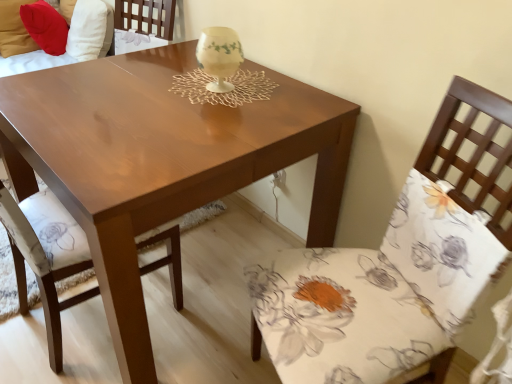
Question: Is velvet red pillow at upper left, marked as the second couch in a left-to-right arrangement, far away from ivory porcelain candle holder at center?

Choices:
 (A) yes
 (B) no

Answer: (A)

Question: Is the depth of velvet red pillow at upper left, marked as the second couch in a left-to-right arrangement, less than that of ivory porcelain candle holder at center?

Choices:
 (A) no
 (B) yes

Answer: (A)

Question: From a real-world perspective, is velvet red pillow at upper left, positioned as the 1th couch in right-to-left order, positioned over ivory porcelain candle holder at center based on gravity?

Choices:
 (A) no
 (B) yes

Answer: (A)

Question: From the image's perspective, is velvet red pillow at upper left, marked as the second couch in a left-to-right arrangement, below ivory porcelain candle holder at center?

Choices:
 (A) no
 (B) yes

Answer: (A)

Question: Would you say velvet red pillow at upper left, positioned as the 1th couch in right-to-left order, is outside ivory porcelain candle holder at center?

Choices:
 (A) yes
 (B) no

Answer: (A)

Question: Is velvet red pillow at upper left, positioned as the 1th couch in right-to-left order, wider than ivory porcelain candle holder at center?

Choices:
 (A) no
 (B) yes

Answer: (B)

Question: Does floral fabric chair at right, the 1th chair from the right, appear on the right side of ivory porcelain candle holder at center?

Choices:
 (A) no
 (B) yes

Answer: (B)

Question: From the image's perspective, would you say floral fabric chair at right, the 1th chair from the right, is positioned over ivory porcelain candle holder at center?

Choices:
 (A) no
 (B) yes

Answer: (A)

Question: From the image's perspective, is floral fabric chair at right, which is the second chair in left-to-right order, below ivory porcelain candle holder at center?

Choices:
 (A) yes
 (B) no

Answer: (A)

Question: Is floral fabric chair at right, which is the second chair in left-to-right order, positioned behind ivory porcelain candle holder at center?

Choices:
 (A) no
 (B) yes

Answer: (A)

Question: Can we say floral fabric chair at right, the 1th chair from the right, lies outside ivory porcelain candle holder at center?

Choices:
 (A) yes
 (B) no

Answer: (A)

Question: Does floral fabric chair at right, which is the second chair in left-to-right order, contain ivory porcelain candle holder at center?

Choices:
 (A) yes
 (B) no

Answer: (B)

Question: Considering the relative positions of ivory porcelain candle holder at center and velvet red pillow at upper left, positioned as the 1th couch in right-to-left order, in the image provided, is ivory porcelain candle holder at center to the right of velvet red pillow at upper left, positioned as the 1th couch in right-to-left order, from the viewer's perspective?

Choices:
 (A) yes
 (B) no

Answer: (A)